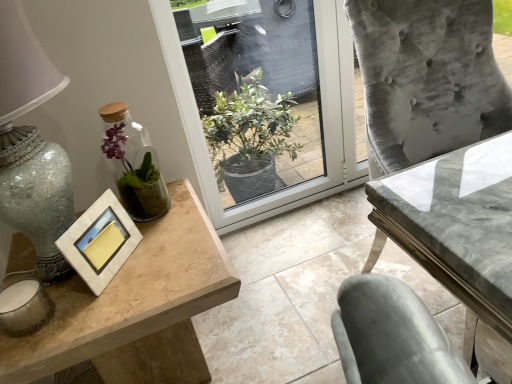
Find the location of a particular element. This screenshot has width=512, height=384. unoccupied region to the right of wooden table at left, marked as the second table in a right-to-left arrangement is located at coordinates (285, 302).